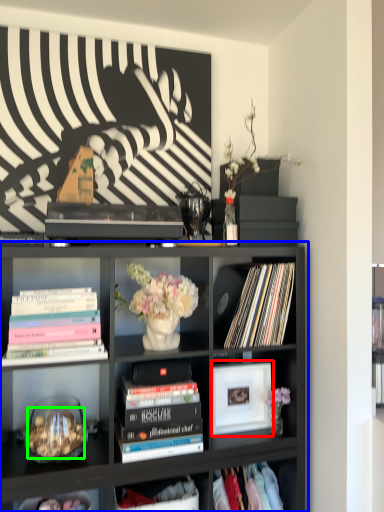
Question: Which object is the closest to the picture frame (highlighted by a red box)? Choose among these: bookcase (highlighted by a blue box) or food (highlighted by a green box).

Choices:
 (A) bookcase
 (B) food

Answer: (A)